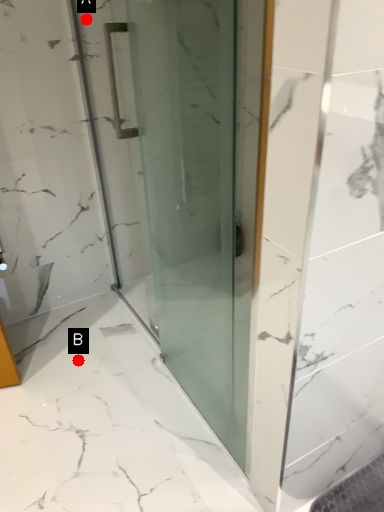
Question: Two points are circled on the image, labeled by A and B beside each circle. Which point is farther to the camera?

Choices:
 (A) A is further
 (B) B is further

Answer: (B)